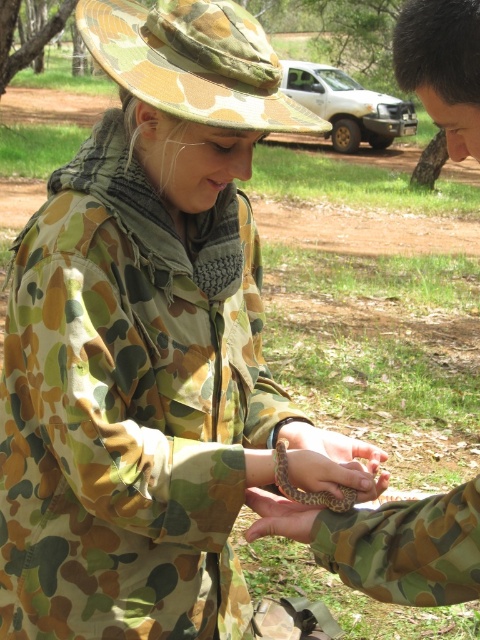
Does camouflage fabric arm at center have a lesser height compared to camouflage-patterned hand at center?

No, camouflage fabric arm at center is not shorter than camouflage-patterned hand at center.

Is camouflage fabric arm at center taller than camouflage-patterned hand at center?

Yes, camouflage fabric arm at center is taller than camouflage-patterned hand at center.

The width and height of the screenshot is (480, 640). I want to click on camouflage fabric arm at center, so click(x=387, y=544).

Image resolution: width=480 pixels, height=640 pixels. I want to click on camouflage fabric arm at center, so click(387, 544).